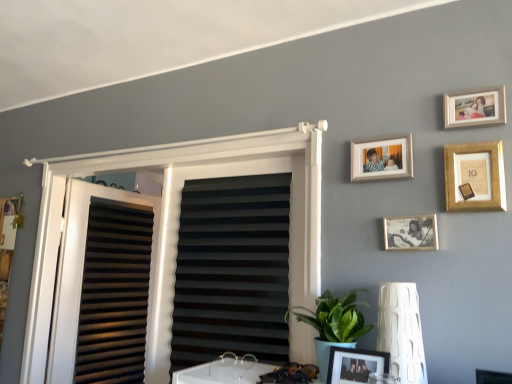
Question: Are gold metallic picture frame at upper right, the third picture frame from the top, and metallic silver photo frame at center-right, which appears as the 4th picture frame when viewed from the top, located far from each other?

Choices:
 (A) no
 (B) yes

Answer: (A)

Question: Is gold metallic picture frame at upper right, the third picture frame from the top, further to the viewer compared to metallic silver photo frame at center-right, the second picture frame ordered from the bottom?

Choices:
 (A) no
 (B) yes

Answer: (A)

Question: Is gold metallic picture frame at upper right, the third picture frame from the top, not inside metallic silver photo frame at center-right, which appears as the 4th picture frame when viewed from the top?

Choices:
 (A) yes
 (B) no

Answer: (A)

Question: Does gold metallic picture frame at upper right, the third picture frame from the top, have a smaller size compared to metallic silver photo frame at center-right, which appears as the 4th picture frame when viewed from the top?

Choices:
 (A) no
 (B) yes

Answer: (A)

Question: Is gold metallic picture frame at upper right, the third picture frame from the top, taller than metallic silver photo frame at center-right, which appears as the 4th picture frame when viewed from the top?

Choices:
 (A) no
 (B) yes

Answer: (B)

Question: Does gold metallic picture frame at upper right, arranged as the third picture frame when ordered from the bottom, touch metallic silver photo frame at center-right, which appears as the 4th picture frame when viewed from the top?

Choices:
 (A) no
 (B) yes

Answer: (A)

Question: Can you confirm if white textured lamp at lower right is positioned to the left of green leafy plant at lower center?

Choices:
 (A) yes
 (B) no

Answer: (B)

Question: Does white textured lamp at lower right come in front of green leafy plant at lower center?

Choices:
 (A) yes
 (B) no

Answer: (A)

Question: From the image's perspective, is white textured lamp at lower right beneath green leafy plant at lower center?

Choices:
 (A) yes
 (B) no

Answer: (B)

Question: Considering the relative positions of white textured lamp at lower right and green leafy plant at lower center in the image provided, is white textured lamp at lower right to the right of green leafy plant at lower center from the viewer's perspective?

Choices:
 (A) no
 (B) yes

Answer: (B)

Question: Can you confirm if white textured lamp at lower right is wider than green leafy plant at lower center?

Choices:
 (A) yes
 (B) no

Answer: (B)

Question: From a real-world perspective, is white textured lamp at lower right physically below green leafy plant at lower center?

Choices:
 (A) no
 (B) yes

Answer: (A)

Question: Is green leafy plant at lower center wider than gold metallic picture frame at upper right, arranged as the third picture frame when ordered from the bottom?

Choices:
 (A) no
 (B) yes

Answer: (B)